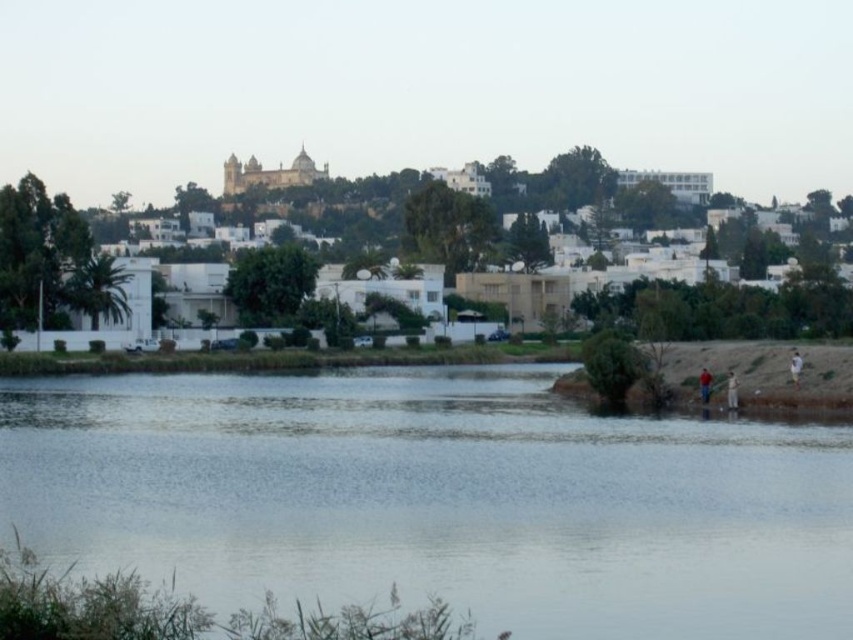
You are standing at the lakeside and want to walk from the clear water at lower center to the white cotton shirt at lower right. Which direction should you move to reach it?

The clear water at lower center is in front of the white cotton shirt at lower right, so to reach the white cotton shirt at lower right, you should move backward.

Consider the image. You are standing on the lakeside and want to pick up the brown leather jacket at lower right and the white cotton shirt at lower right. Which one is closer to you?

The brown leather jacket at lower right is closer to you than the white cotton shirt at lower right because it is further to the viewer.

You are standing at the center of the image and want to walk towards the clear water at lower center. According to the coordinates provided, in which direction should you move?

The clear water at lower center is located at point (x=437, y=499). Since the coordinates are based on a grid where 0 is the bottom and 1 is the top, moving towards the right and slightly upwards from the center would lead you to the clear water at lower center.